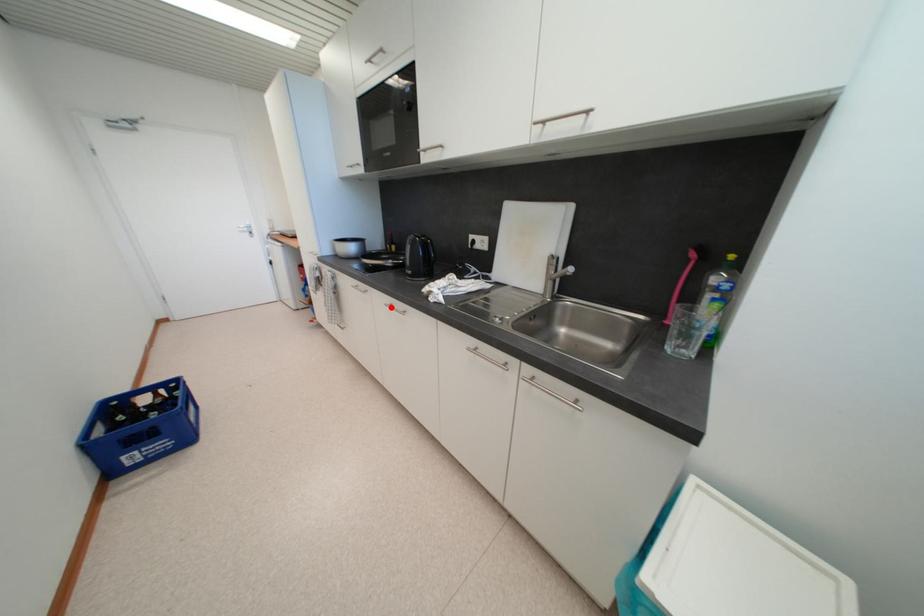
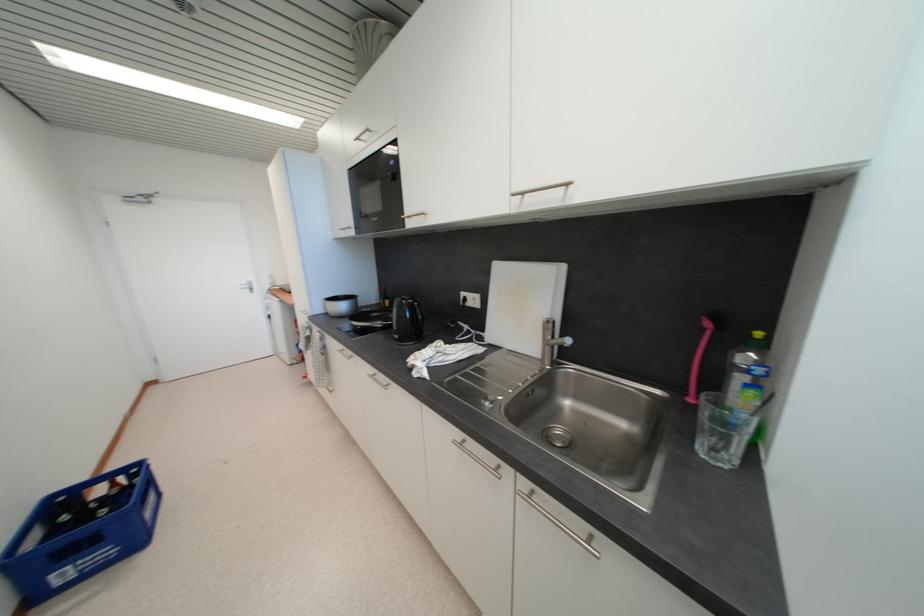
Question: I am providing you with two images of the same scene from different viewpoints. Given a red point in image1, look at the same physical point in image2. Is it:

Choices:
 (A) Closer to the viewpoint
 (B) Farther from the viewpoint

Answer: (B)